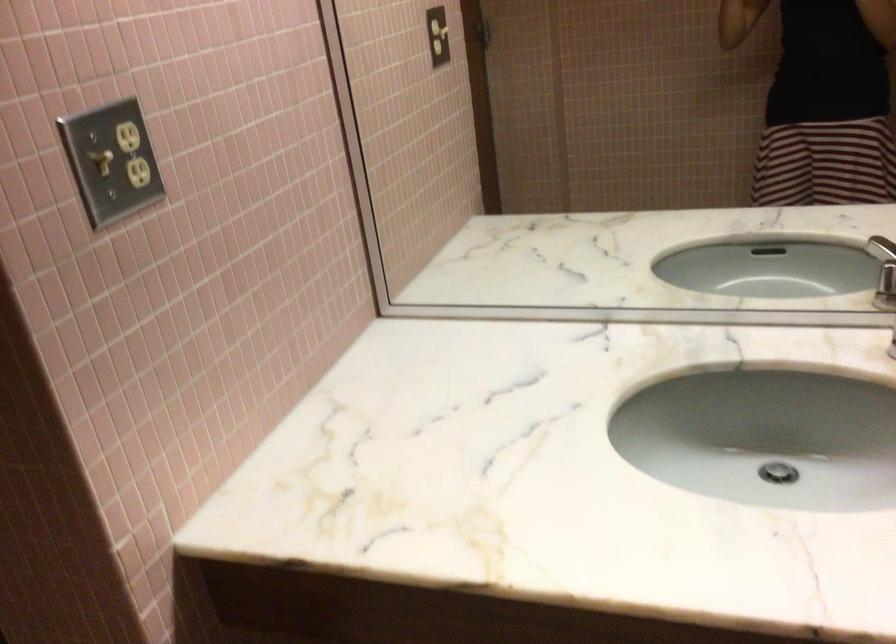
The image size is (896, 644). Identify the location of faucet handle. (883, 270).